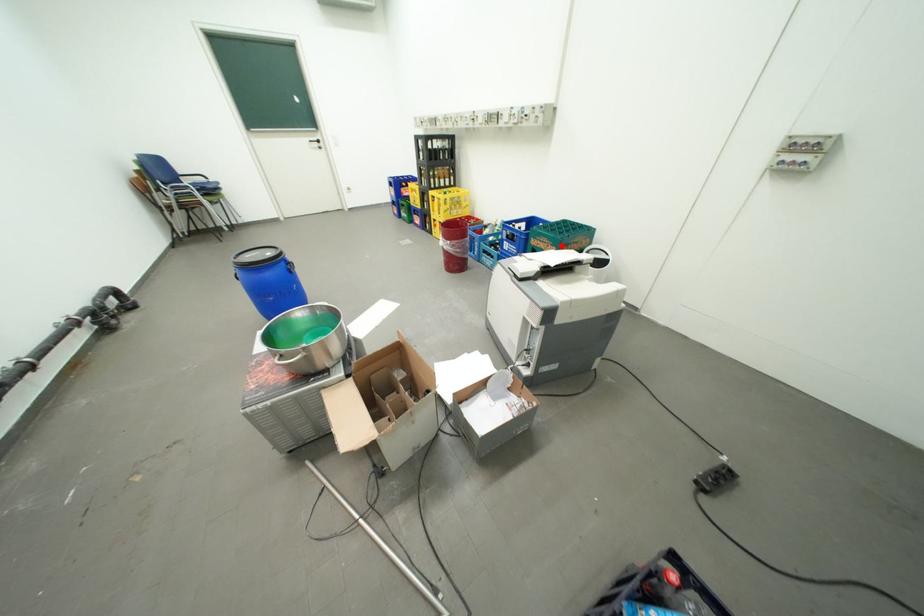
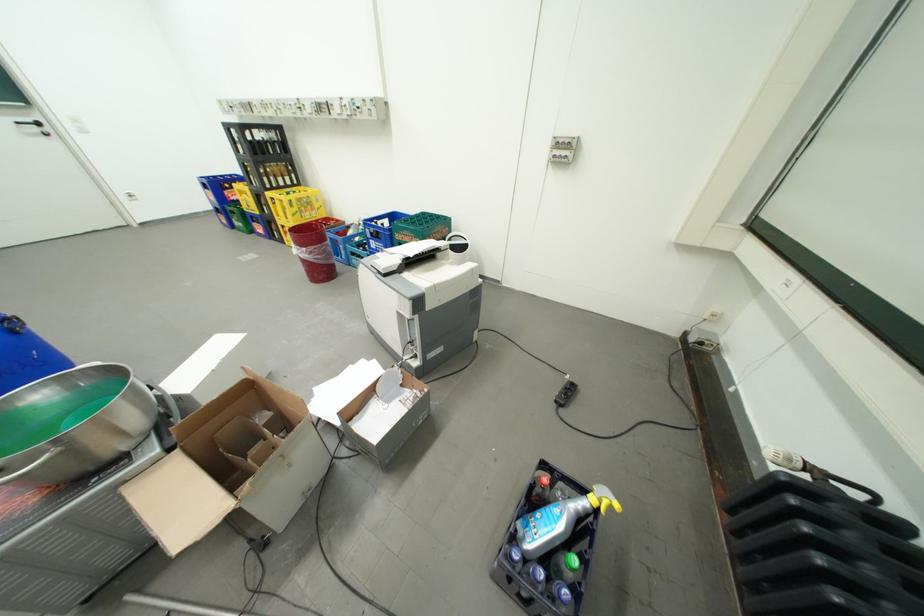
Locate, in the second image, the point that corresponds to the highlighted location in the first image.

(424, 238)